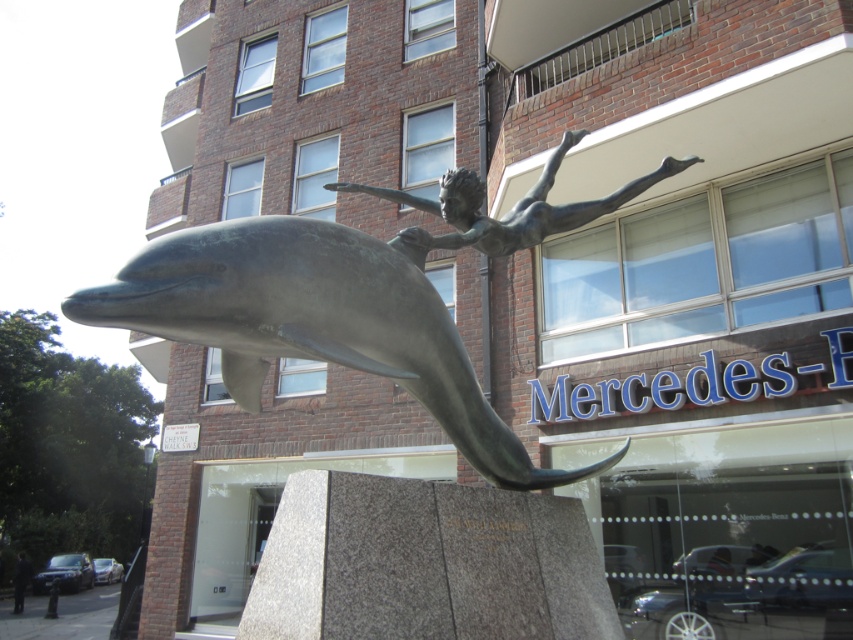
Is point (241, 280) positioned in front of point (485, 195)?

That is True.

Is bronze dolphin at center smaller than bronze statue at upper center?

Incorrect, bronze dolphin at center is not smaller in size than bronze statue at upper center.

Where is `bronze dolphin at center`? This screenshot has height=640, width=853. bronze dolphin at center is located at coordinates (315, 321).